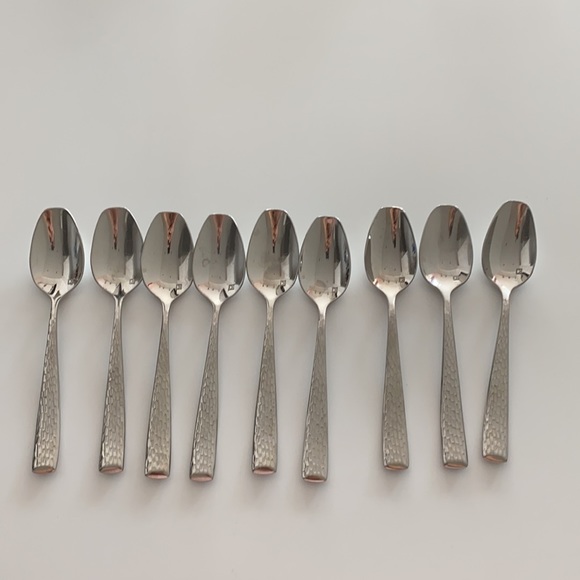
At what (x,y) coordinates should I click in order to perform the action: click on handle. Please return your answer as a coordinate pair (x, y). Looking at the image, I should click on (44, 419), (113, 416), (164, 420), (206, 424), (266, 420), (316, 424), (394, 414), (452, 409), (493, 409).